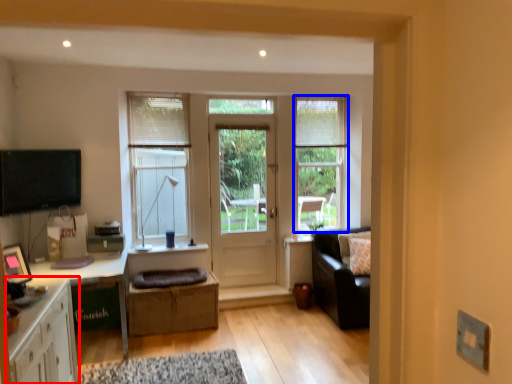
Question: Which object is closer to the camera taking this photo, cabinetry (highlighted by a red box) or window (highlighted by a blue box)?

Choices:
 (A) cabinetry
 (B) window

Answer: (A)